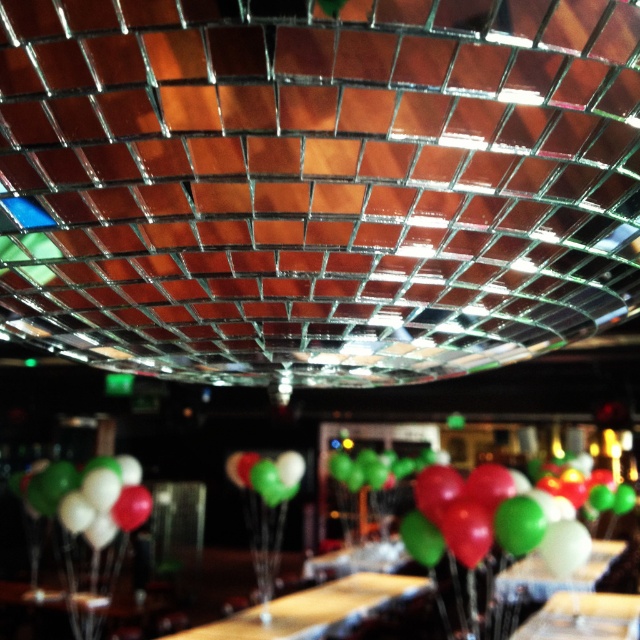
Is green glossy balloon at lower center further to the viewer compared to green matte balloon at center?

No, green glossy balloon at lower center is closer to the viewer.

Is point (48, 506) closer to camera compared to point (243, 452)?

Yes, point (48, 506) is in front of point (243, 452).

Locate an element on the screen. green glossy balloon at lower center is located at coordinates (88, 496).

Is wooden table at center to the right of green glossy balloon at lower center from the viewer's perspective?

Yes, wooden table at center is to the right of green glossy balloon at lower center.

Is the position of wooden table at center more distant than that of green glossy balloon at lower center?

That is False.

Between point (256, 624) and point (22, 499), which one is positioned behind?

The point (22, 499) is behind.

I want to click on wooden table at center, so click(314, 609).

Can you confirm if wooden table at center is positioned to the right of green matte balloon at center?

Indeed, wooden table at center is positioned on the right side of green matte balloon at center.

Who is more forward, (168, 636) or (237, 476)?

Positioned in front is point (168, 636).

Identify the location of wooden table at center. The width and height of the screenshot is (640, 640). (314, 609).